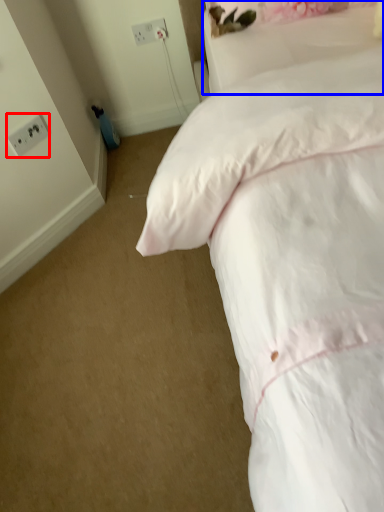
Question: Which object is closer to the camera taking this photo, electric outlet (highlighted by a red box) or pillow (highlighted by a blue box)?

Choices:
 (A) electric outlet
 (B) pillow

Answer: (B)